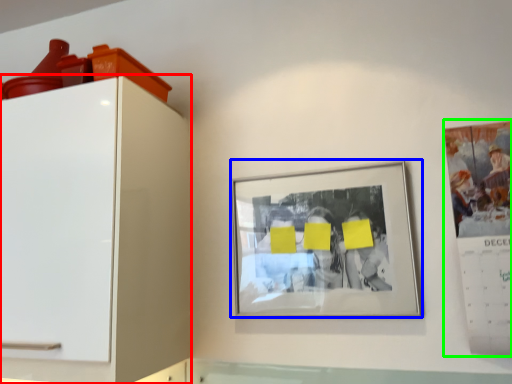
Question: Considering the real-world distances, which object is closest to furniture (highlighted by a red box)? picture frame (highlighted by a blue box) or poster (highlighted by a green box).

Choices:
 (A) picture frame
 (B) poster

Answer: (A)